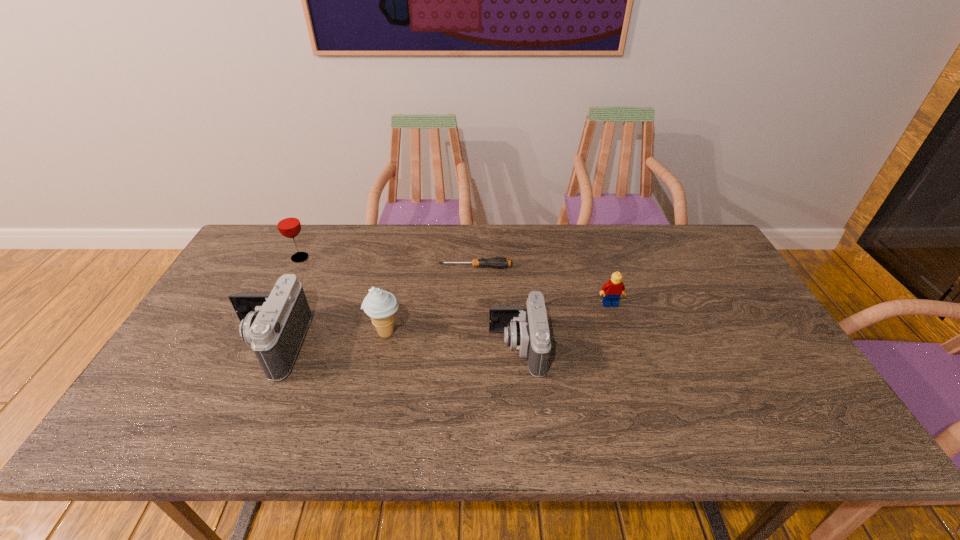
All cameras are currently evenly spaced. To continue this pattern, where would you add another camera on the right? Please point out a vacant spot. Please provide its 2D coordinates. Your answer should be formatted as a tuple, i.e. [(x, y)], where the tuple contains the x and y coordinates of a point satisfying the conditions above.

[(769, 352)]